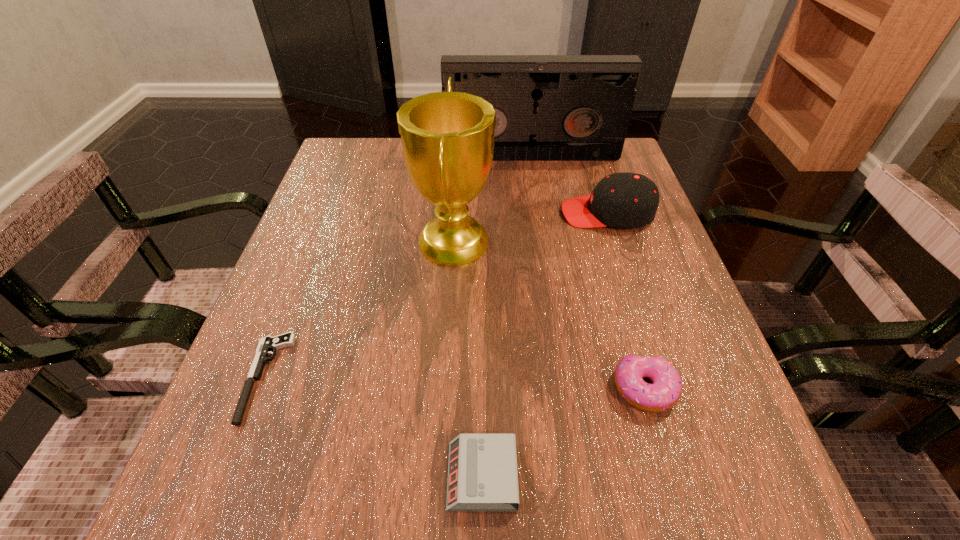
Find the location of a particular element. The height and width of the screenshot is (540, 960). blank area located 0.060m on the front side of the videotape is located at coordinates (535, 174).

I want to click on vacant space located 0.300m on the front-facing side of the third tallest object, so click(x=429, y=213).

Find the location of `vacant position located on the front-facing side of the third tallest object`. vacant position located on the front-facing side of the third tallest object is located at coordinates pyautogui.click(x=531, y=213).

Identify the location of vacant space located on the front-facing side of the third tallest object. (535, 213).

You are a GUI agent. You are given a task and a screenshot of the screen. Output one action in this format:
    pyautogui.click(x=<x>, y=<y>)
    Task: Click on the vacant space located on the back of the doughnut
    The width and height of the screenshot is (960, 540).
    Given the screenshot: What is the action you would take?
    pyautogui.click(x=628, y=329)

Identify the location of blank area located on the right of the alarm clock. This screenshot has width=960, height=540. (736, 476).

This screenshot has height=540, width=960. I want to click on object located at the far edge, so click(x=548, y=107).

This screenshot has height=540, width=960. What are the coordinates of `object that is at the near edge` in the screenshot? It's located at (482, 470).

This screenshot has height=540, width=960. In order to click on object located in the left edge section of the desktop in this screenshot , I will do `click(266, 344)`.

Locate an element on the screen. videotape present at the right edge is located at coordinates (548, 107).